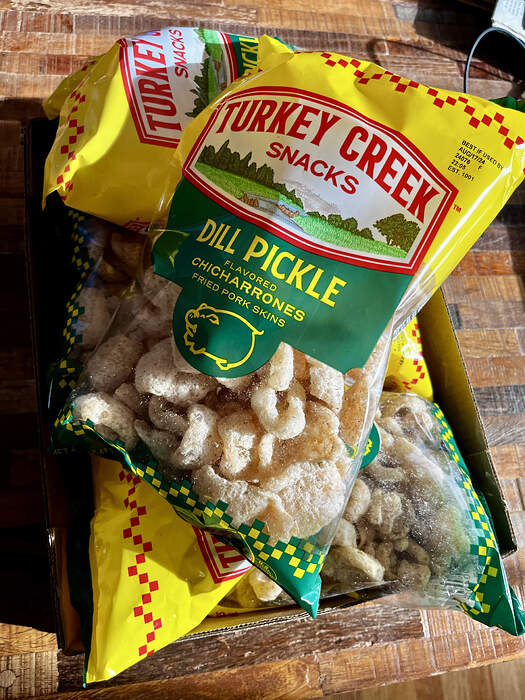
Locate an element on the screen. This screenshot has height=700, width=525. box is located at coordinates (470, 407).